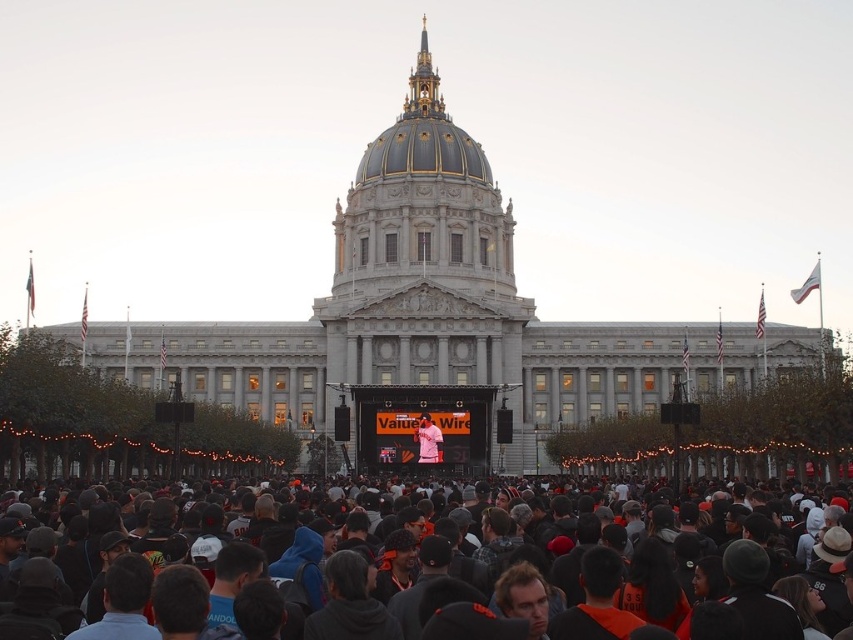
Question: Is black fabric crowd at center to the left of gold-plated dome at center from the viewer's perspective?

Choices:
 (A) no
 (B) yes

Answer: (B)

Question: Which object is closer to the camera taking this photo?

Choices:
 (A) black fabric crowd at center
 (B) matte pink shirt at center
 (C) gold-plated dome at center

Answer: (A)

Question: Does black fabric crowd at center appear over matte pink shirt at center?

Choices:
 (A) no
 (B) yes

Answer: (A)

Question: Observing the image, what is the correct spatial positioning of gold-plated dome at center in reference to matte pink shirt at center?

Choices:
 (A) above
 (B) below

Answer: (A)

Question: Among these points, which one is farthest from the camera?

Choices:
 (A) (761, 548)
 (B) (439, 456)

Answer: (B)

Question: Based on their relative distances, which object is farther from the gold-plated dome at center?

Choices:
 (A) matte pink shirt at center
 (B) black fabric crowd at center

Answer: (B)